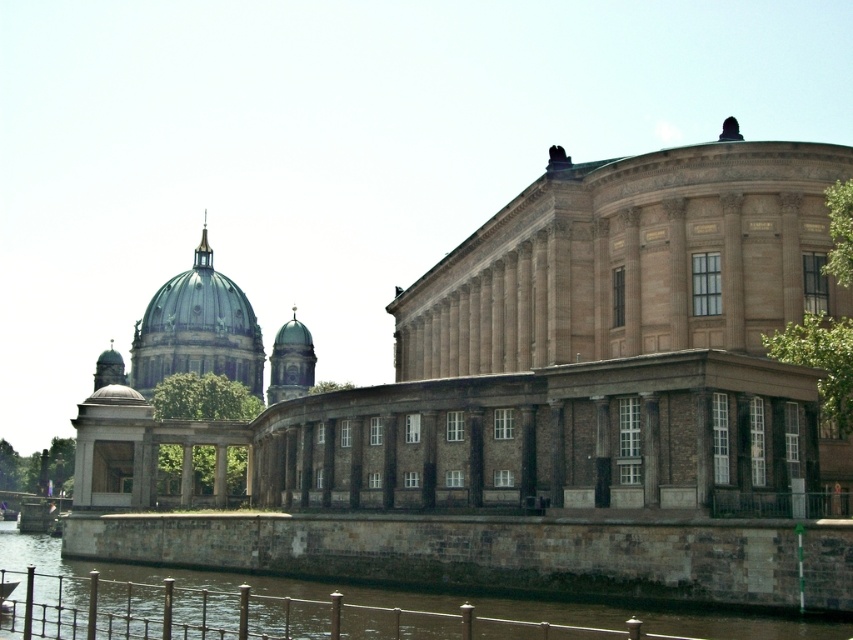
You are standing in the historic waterfront area and want to take a photo of the brown stone building at center and the brown stone wall at lower left. Which one should you position yourself to the right of to capture both in the frame?

You should position yourself to the right of the brown stone wall at lower left because the brown stone building at center is located to the left of the brown stone wall at lower left, so positioning yourself to the right of the wall will allow both structures to be captured in the frame.

You are standing at the point marked by the coordinates point (x=548, y=358) in the historic waterfront scene. Looking around, you see a dome topped greenish blue metallic cathedral on the left and a neoclassical building with columns on the right. Which direction should you face to see the brown stone building at center?

The point (x=548, y=358) indicates the brown stone building at center, so you are already at that location. Facing forward would allow you to see both the dome topped greenish blue metallic cathedral on the left and the neoclassical building with columns on the right.

You are an architect planning to place a new statue between the brown stone building at center and the brown stone wall at lower left. Considering their widths, which structure will require more space on the waterfront? Please explain your reasoning based on their dimensions.

The brown stone building at center requires more space on the waterfront because its width is larger than that of the brown stone wall at lower left.